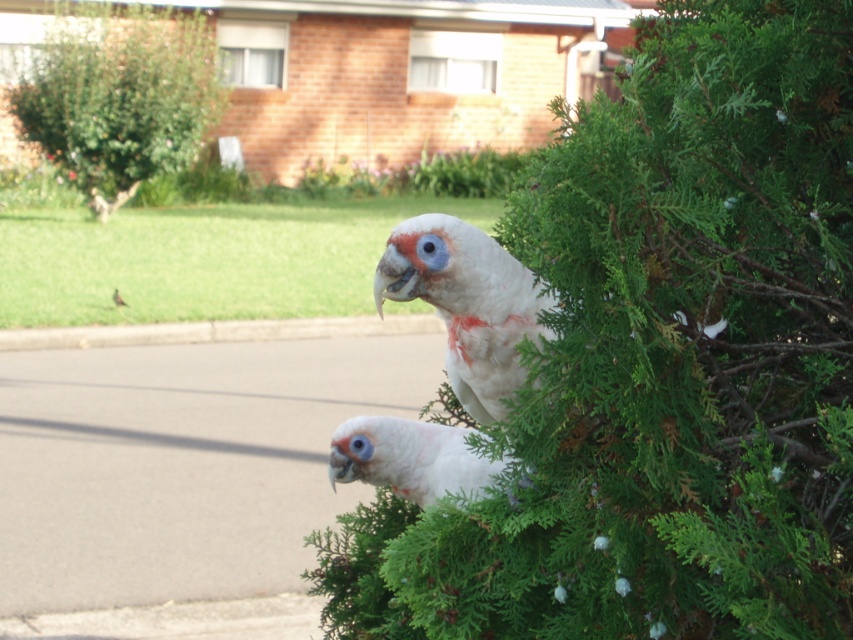
Can you confirm if green leafy bush at upper right is smaller than white feathered parrot at center?

Actually, green leafy bush at upper right might be larger than white feathered parrot at center.

Based on the photo, who is lower down, green leafy bush at upper right or white feathered parrot at center?

white feathered parrot at center is below.

Between point (695, 45) and point (334, 449), which one is positioned behind?

The point (334, 449) is behind.

Locate an element on the screen. This screenshot has height=640, width=853. green leafy bush at upper right is located at coordinates (662, 364).

Does white matte parrot at center have a greater width compared to white feathered bird at upper center?

Correct, the width of white matte parrot at center exceeds that of white feathered bird at upper center.

Identify the location of white matte parrot at center. tap(466, 304).

Is point (850, 515) in front of point (119, 173)?

Yes.

Is point (672, 333) less distant than point (102, 205)?

Yes.

The height and width of the screenshot is (640, 853). Find the location of `green leafy bush at upper right`. green leafy bush at upper right is located at coordinates (662, 364).